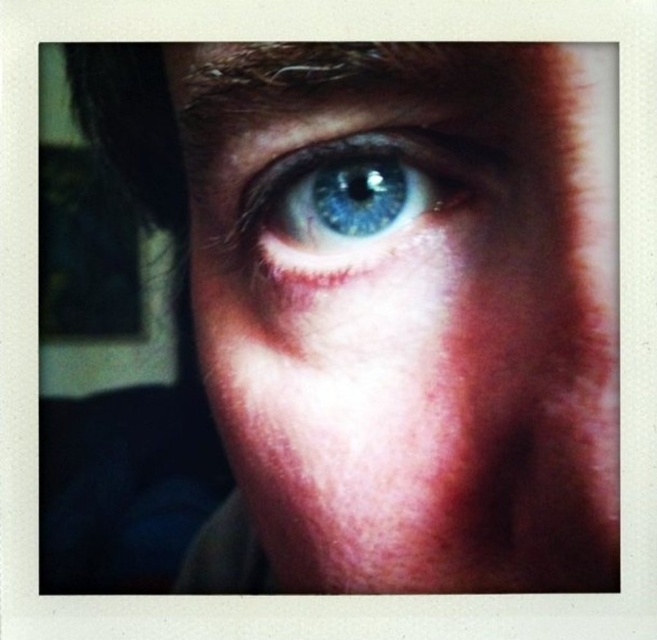
Is the position of blue matte eye at center more distant than that of blue glossy eye at upper center?

No, blue matte eye at center is closer to the viewer.

Does blue matte eye at center have a lesser height compared to blue glossy eye at upper center?

No, blue matte eye at center is not shorter than blue glossy eye at upper center.

Between point (300, 198) and point (369, 132), which one is positioned behind?

Point (300, 198)

Locate an element on the screen. The image size is (657, 640). blue matte eye at center is located at coordinates (401, 310).